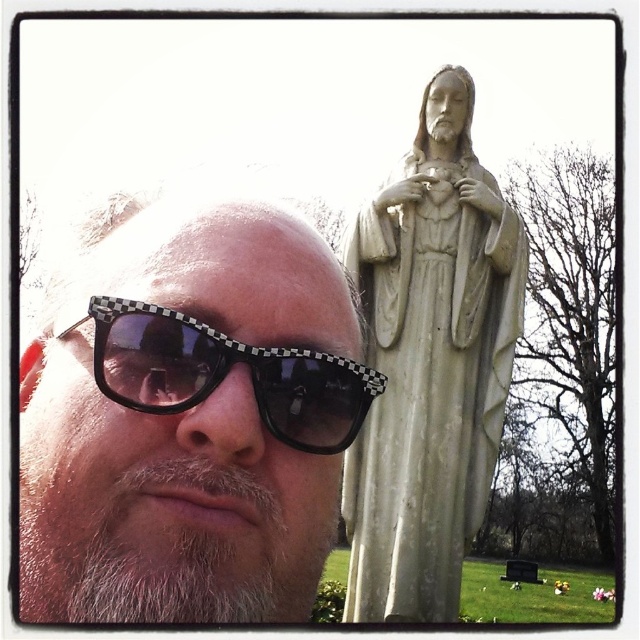
Can you confirm if white stone statue at center is smaller than black checkered sunglasses at center?

Incorrect, white stone statue at center is not smaller in size than black checkered sunglasses at center.

Between white stone statue at center and black checkered sunglasses at center, which one has less height?

black checkered sunglasses at center

Is point (385, 470) behind point (358, 394)?

Yes, point (385, 470) is behind point (358, 394).

The width and height of the screenshot is (640, 640). Identify the location of white stone statue at center. (429, 362).

Is white matte sunglasses at left below black checkered sunglasses at center?

Incorrect, white matte sunglasses at left is not positioned below black checkered sunglasses at center.

Is point (200, 196) closer to viewer compared to point (65, 336)?

That is False.

Identify the location of white matte sunglasses at left. This screenshot has height=640, width=640. (188, 412).

Between white matte sunglasses at left and white stone statue at center, which one appears on the left side from the viewer's perspective?

white matte sunglasses at left is more to the left.

Is white matte sunglasses at left taller than white stone statue at center?

No.

Image resolution: width=640 pixels, height=640 pixels. I want to click on white matte sunglasses at left, so click(x=188, y=412).